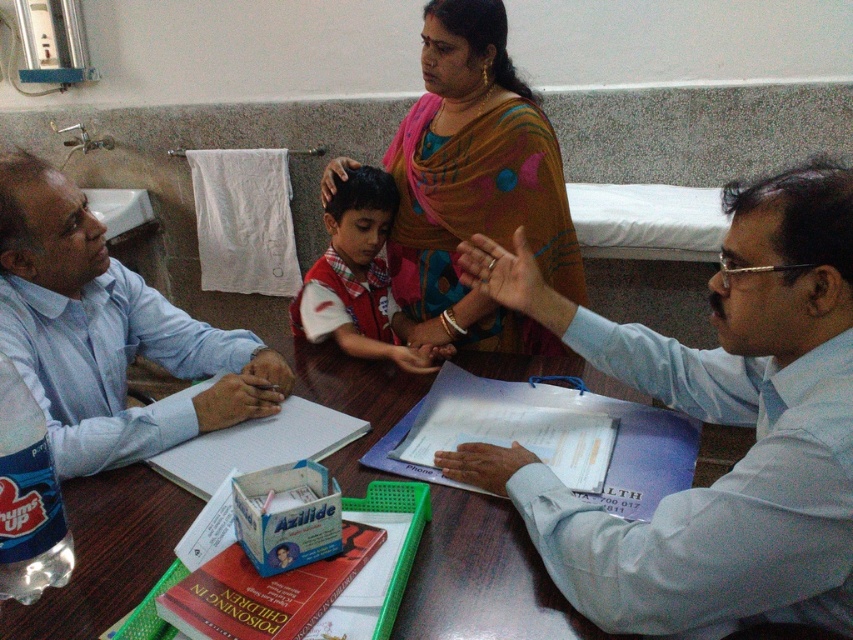
Question: Which point appears farthest from the camera in this image?

Choices:
 (A) (508, 316)
 (B) (405, 618)
 (C) (125, 305)
 (D) (788, 330)

Answer: (A)

Question: Can you confirm if light blue shirt at center is wider than red plaid shirt at center?

Choices:
 (A) no
 (B) yes

Answer: (B)

Question: Which of the following is the farthest from the observer?

Choices:
 (A) light blue shirt at left
 (B) brown polka dot sari at center
 (C) light blue shirt at center
 (D) wooden table at center

Answer: (B)

Question: Does wooden table at center appear over red plaid shirt at center?

Choices:
 (A) no
 (B) yes

Answer: (A)

Question: Does wooden table at center appear on the left side of red plaid shirt at center?

Choices:
 (A) yes
 (B) no

Answer: (B)

Question: Which of these objects is positioned closest to the brown polka dot sari at center?

Choices:
 (A) wooden table at center
 (B) red plaid shirt at center

Answer: (B)